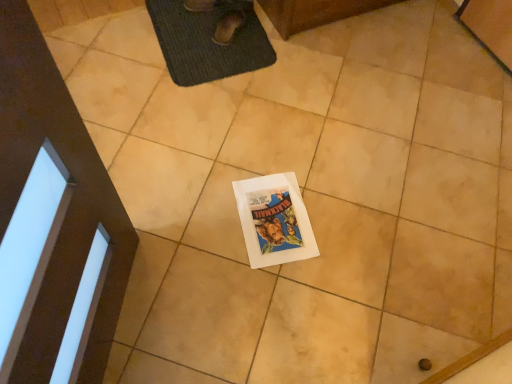
The width and height of the screenshot is (512, 384). What are the coordinates of `vacant space in between dark gray textured bath mat at upper center and white paper comic book at center` in the screenshot? It's located at (243, 131).